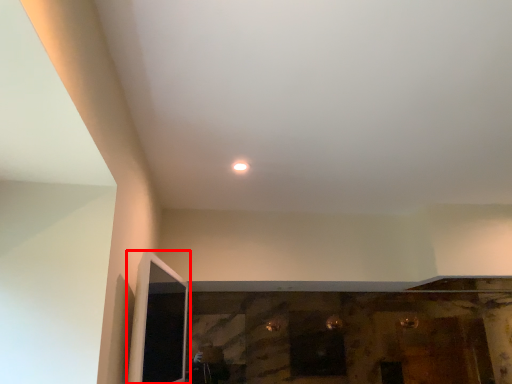
Question: From the image's perspective, what is the correct spatial relationship of screen door (annotated by the red box) in relation to light?

Choices:
 (A) above
 (B) below

Answer: (B)